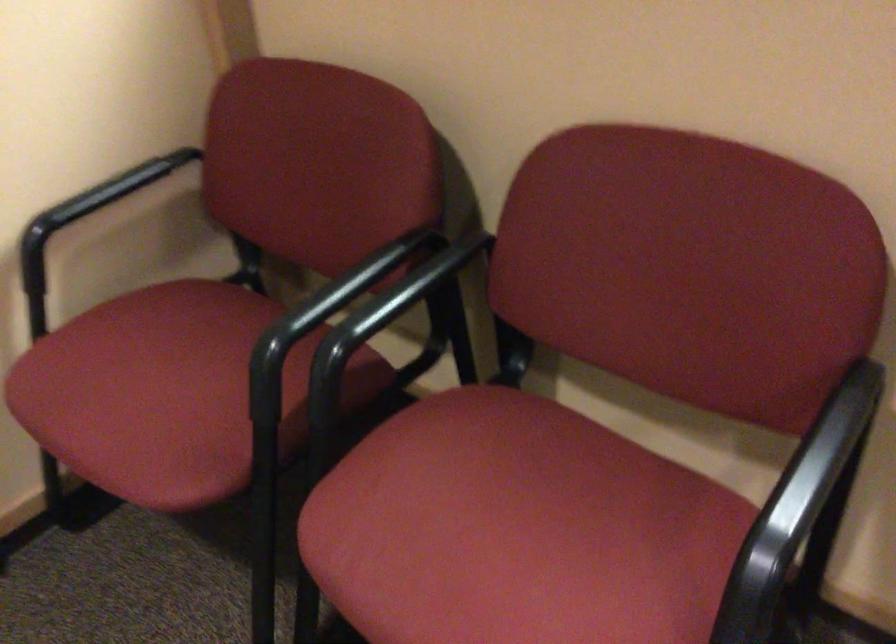
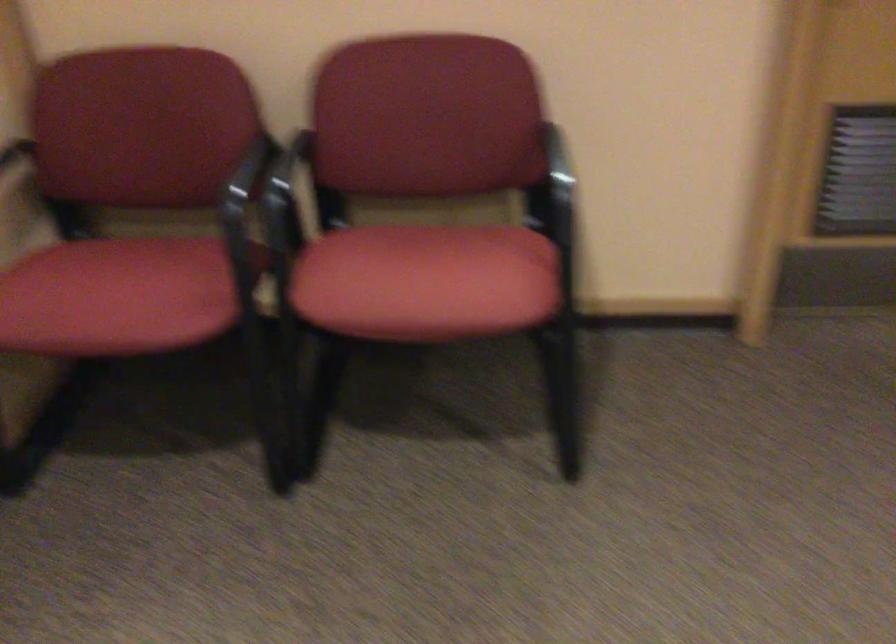
In the second image, find the point that corresponds to point (471, 567) in the first image.

(426, 281)